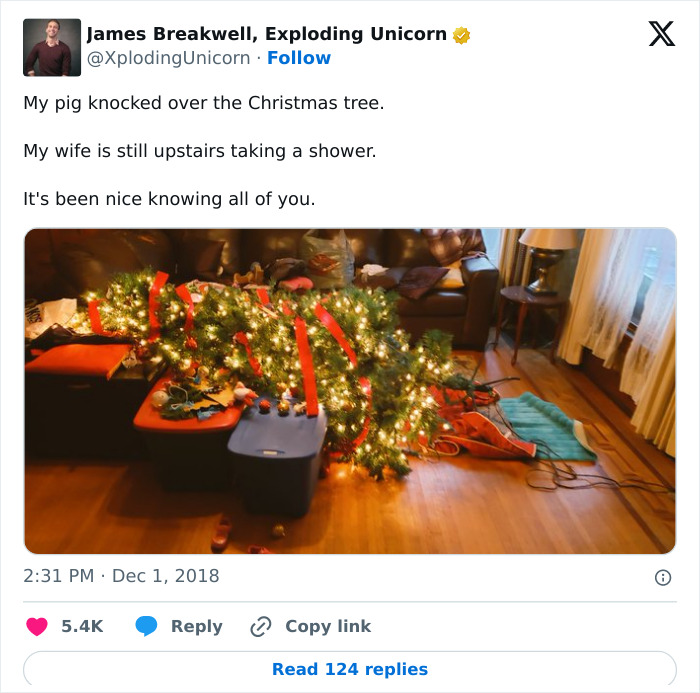
I want to click on wood floor, so click(x=472, y=532).